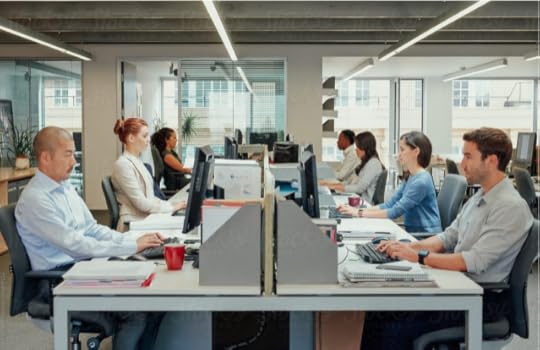
At what (x,y) coordinates should I click in order to perform the action: click on easily visible monitors. Please return your answer as a coordinate pair (x, y). The height and width of the screenshot is (350, 540). Looking at the image, I should click on click(204, 184), click(227, 146), click(239, 138), click(266, 139), click(284, 152), click(308, 168), click(307, 147), click(529, 156).